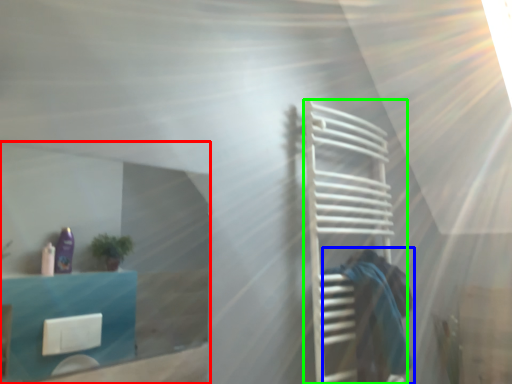
Question: Which object is positioned closest to glass door (highlighted by a red box)? Select from person (highlighted by a blue box) and cage (highlighted by a green box).

Choices:
 (A) person
 (B) cage

Answer: (B)